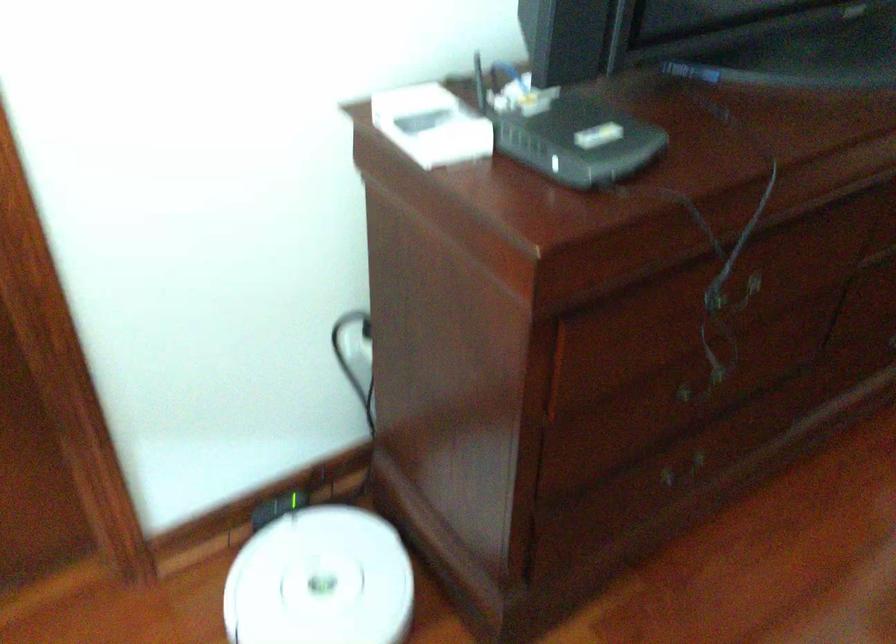
Where would you lift the black router? Please return your answer as a coordinate pair (x, y).

(569, 134)